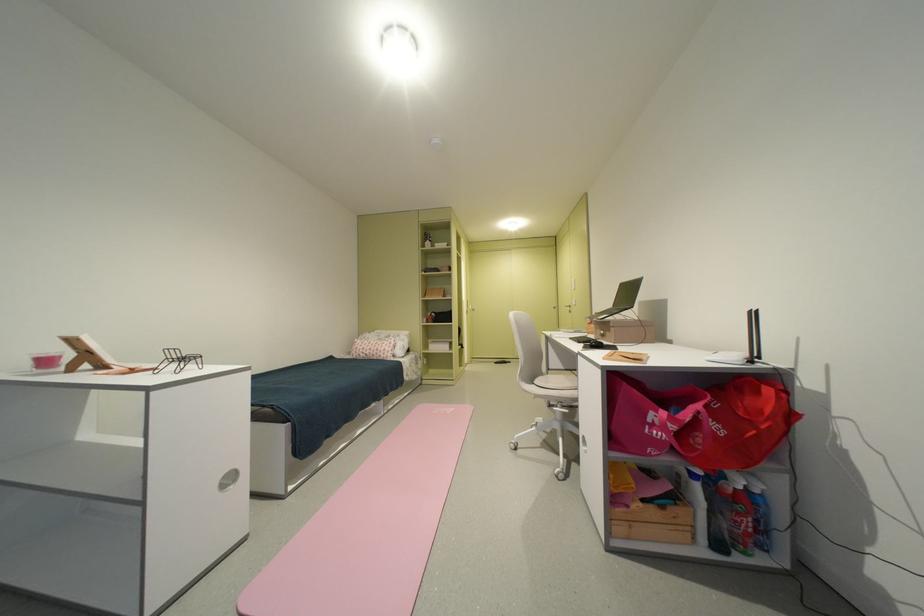
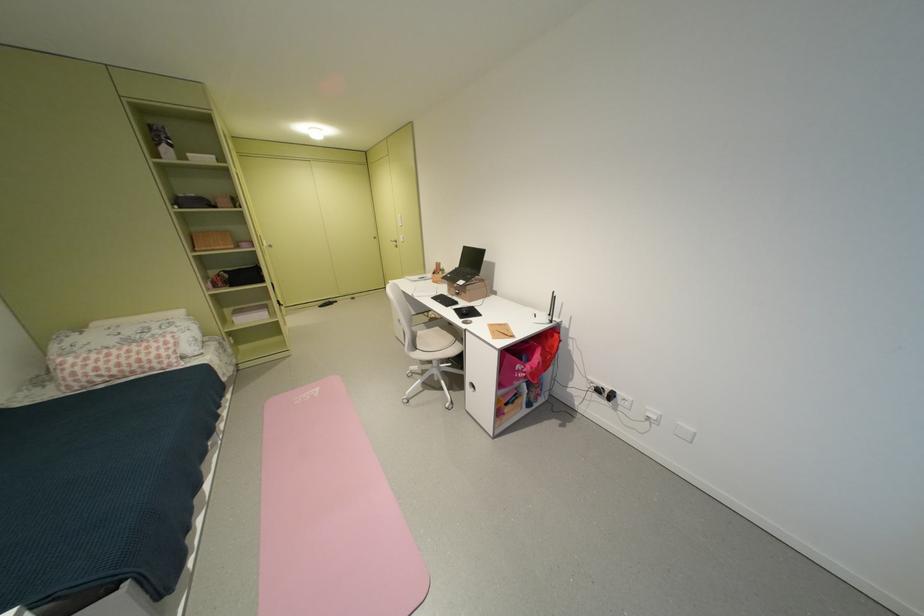
The point at (665, 432) is marked in the first image. Where is the corresponding point in the second image?

(530, 376)